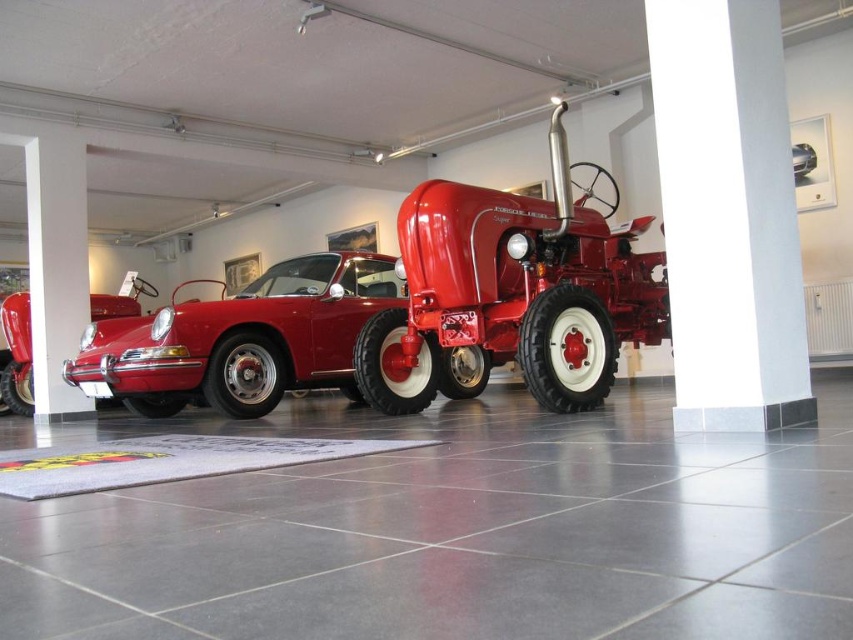
You are a photographer planning to take a photo of both the glossy red car at center and the glossy red car at left for a magazine spread. The magazine requires that the smaller vehicle must be placed in the foreground to emphasize its scale. Based on the scene description, which glossy red car should you position closer to the camera?

The glossy red car at left should be positioned closer to the camera because it is smaller in size than the glossy red car at center, allowing the foreground placement to effectively highlight the scale difference between the two vehicles.

You are an art curator planning to rearrange the vehicles in the exhibition. You want to place a new sculpture between the glossy red car at center and the glossy metallic car at center. Based on their current positions, where should you position the sculpture to ensure it sits between them?

The sculpture should be placed between the glossy red car at center and the glossy metallic car at center, positioned above the glossy red car since it is located below the glossy metallic car.

You are a photographer setting up a shoot in the exhibition space. You want to position your camera so that it captures both the glossy red car at left and the glossy metallic car at center. Based on their positions, which car should you place closer to the camera to ensure both are in frame?

The glossy red car at left is to the left of the glossy metallic car at center, so you should position the camera between them. However, since both are already positioned along a horizontal axis, you can ensure both are in frame by centering the camera between the two cars.